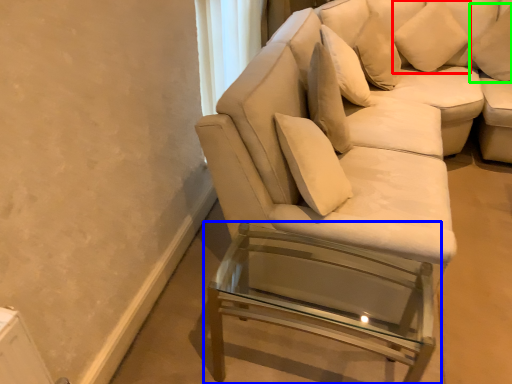
Question: Which is farther away from pillow (highlighted by a red box)? table (highlighted by a blue box) or pillow (highlighted by a green box)?

Choices:
 (A) table
 (B) pillow

Answer: (A)